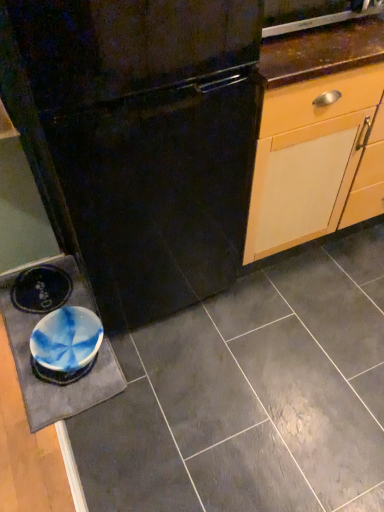
Image resolution: width=384 pixels, height=512 pixels. Describe the element at coordinates (139, 140) in the screenshot. I see `black matte refrigerator at center` at that location.

Locate an element on the screen. The width and height of the screenshot is (384, 512). blue marbled slate at lower left is located at coordinates (53, 384).

Locate an element on the screen. The image size is (384, 512). black matte refrigerator at center is located at coordinates [x=139, y=140].

Based on the photo, how far apart are metallic stainless steel dishwasher at upper right and black matte refrigerator at center?

metallic stainless steel dishwasher at upper right and black matte refrigerator at center are 53.33 centimeters apart from each other.

Considering the positions of objects metallic stainless steel dishwasher at upper right and black matte refrigerator at center in the image provided, who is more to the right, metallic stainless steel dishwasher at upper right or black matte refrigerator at center?

metallic stainless steel dishwasher at upper right is more to the right.

Based on the photo, which object is wider, metallic stainless steel dishwasher at upper right or black matte refrigerator at center?

With larger width is black matte refrigerator at center.

Can you confirm if metallic stainless steel dishwasher at upper right is wider than blue marbled slate at lower left?

Correct, the width of metallic stainless steel dishwasher at upper right exceeds that of blue marbled slate at lower left.

From a real-world perspective, is metallic stainless steel dishwasher at upper right on top of blue marbled slate at lower left?

Yes, from a real-world perspective, metallic stainless steel dishwasher at upper right is over blue marbled slate at lower left

From the image's perspective, between metallic stainless steel dishwasher at upper right and blue marbled slate at lower left, who is located below?

From the image's view, blue marbled slate at lower left is below.

Is matte ceramic tile at center with metallic stainless steel dishwasher at upper right?

No.

Which of these two, matte ceramic tile at center or metallic stainless steel dishwasher at upper right, is smaller?

metallic stainless steel dishwasher at upper right.

In terms of width, does matte ceramic tile at center look wider or thinner when compared to metallic stainless steel dishwasher at upper right?

In the image, matte ceramic tile at center appears to be wider than metallic stainless steel dishwasher at upper right.

From a real-world perspective, does matte ceramic tile at center stand above metallic stainless steel dishwasher at upper right?

Actually, matte ceramic tile at center is physically below metallic stainless steel dishwasher at upper right in the real world.

Relative to blue marbled slate at lower left, is matte ceramic tile at center in front or behind?

Clearly, matte ceramic tile at center is in front of blue marbled slate at lower left.

Can you confirm if matte ceramic tile at center is positioned to the left of blue marbled slate at lower left?

No, matte ceramic tile at center is not to the left of blue marbled slate at lower left.

You are a GUI agent. You are given a task and a screenshot of the screen. Output one action in this format:
    pyautogui.click(x=<x>, y=<y>)
    Task: Click on the ceramic tile on the right side of blue marbled slate at lower left
    
    Given the screenshot: What is the action you would take?
    pyautogui.click(x=251, y=396)

Is matte ceramic tile at center with blue marbled slate at lower left?

No, matte ceramic tile at center is not next to blue marbled slate at lower left.

Is blue marbled slate at lower left not near matte ceramic tile at center?

No, blue marbled slate at lower left is not far from matte ceramic tile at center.

Which object is wider, blue marbled slate at lower left or matte ceramic tile at center?

matte ceramic tile at center.

Which of these two, blue marbled slate at lower left or matte ceramic tile at center, stands shorter?

matte ceramic tile at center.

Which of these two, blue marbled slate at lower left or metallic stainless steel dishwasher at upper right, is wider?

metallic stainless steel dishwasher at upper right.

Is blue marbled slate at lower left positioned before metallic stainless steel dishwasher at upper right?

That is False.

Is point (85, 396) closer to camera compared to point (267, 2)?

No, it is behind (267, 2).

From the picture: From a real-world perspective, is blue marbled slate at lower left over metallic stainless steel dishwasher at upper right?

Incorrect, from a real-world perspective, blue marbled slate at lower left is lower than metallic stainless steel dishwasher at upper right.

Which of these two, metallic stainless steel dishwasher at upper right or matte ceramic tile at center, stands shorter?

matte ceramic tile at center.

Does metallic stainless steel dishwasher at upper right have a smaller size compared to matte ceramic tile at center?

Yes, metallic stainless steel dishwasher at upper right is smaller than matte ceramic tile at center.

From a real-world perspective, does metallic stainless steel dishwasher at upper right stand above matte ceramic tile at center?

Yes, from a real-world perspective, metallic stainless steel dishwasher at upper right is above matte ceramic tile at center.

Does metallic stainless steel dishwasher at upper right touch matte ceramic tile at center?

No, metallic stainless steel dishwasher at upper right is not next to matte ceramic tile at center.

Identify the location of home appliance that appears on the right of black matte refrigerator at center. (313, 14).

Find the location of a particular element. This screenshot has width=384, height=512. home appliance positioned vertically above the blue marbled slate at lower left (from a real-world perspective) is located at coordinates (313, 14).

Considering their positions, is black matte refrigerator at center positioned further to blue marbled slate at lower left than matte ceramic tile at center?

black matte refrigerator at center is positioned further to the anchor blue marbled slate at lower left.

From the image, which object appears to be farther from metallic stainless steel dishwasher at upper right, black matte refrigerator at center or matte ceramic tile at center?

matte ceramic tile at center lies further to metallic stainless steel dishwasher at upper right than the other object.

Considering their positions, is metallic stainless steel dishwasher at upper right positioned closer to black matte refrigerator at center than matte ceramic tile at center?

metallic stainless steel dishwasher at upper right is closer to black matte refrigerator at center.

Considering their positions, is black matte refrigerator at center positioned closer to blue marbled slate at lower left than metallic stainless steel dishwasher at upper right?

black matte refrigerator at center.

When comparing their distances from matte ceramic tile at center, does metallic stainless steel dishwasher at upper right or blue marbled slate at lower left seem closer?

blue marbled slate at lower left lies closer to matte ceramic tile at center than the other object.

Consider the image. Based on their spatial positions, is matte ceramic tile at center or black matte refrigerator at center further from metallic stainless steel dishwasher at upper right?

matte ceramic tile at center is further to metallic stainless steel dishwasher at upper right.

Which object lies nearer to the anchor point blue marbled slate at lower left, matte ceramic tile at center or metallic stainless steel dishwasher at upper right?

Among the two, matte ceramic tile at center is located nearer to blue marbled slate at lower left.

Estimate the real-world distances between objects in this image. Which object is further from black matte refrigerator at center, matte ceramic tile at center or metallic stainless steel dishwasher at upper right?

Based on the image, matte ceramic tile at center appears to be further to black matte refrigerator at center.

You are a GUI agent. You are given a task and a screenshot of the screen. Output one action in this format:
    pyautogui.click(x=<x>, y=<y>)
    Task: Click on the ceramic tile between black matte refrigerator at center and blue marbled slate at lower left vertically
    
    Given the screenshot: What is the action you would take?
    pyautogui.click(x=251, y=396)

Find the location of a particular element. The width and height of the screenshot is (384, 512). ceramic tile between metallic stainless steel dishwasher at upper right and blue marbled slate at lower left in the vertical direction is located at coordinates [251, 396].

Locate an element on the screen. The image size is (384, 512). refrigerator between metallic stainless steel dishwasher at upper right and matte ceramic tile at center in the up-down direction is located at coordinates (139, 140).

The image size is (384, 512). I want to click on refrigerator that lies between metallic stainless steel dishwasher at upper right and blue marbled slate at lower left from top to bottom, so click(x=139, y=140).